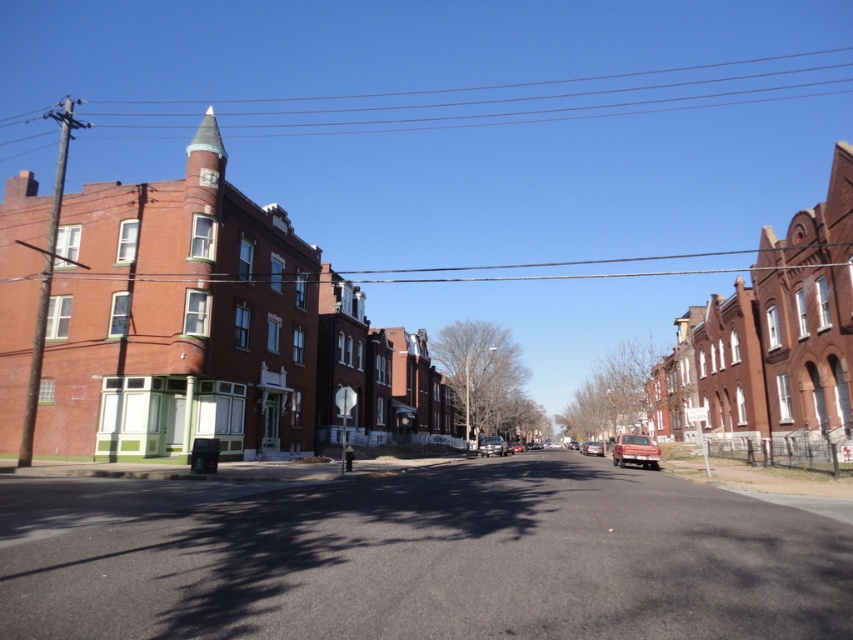
Question: Can you confirm if matte red car at center is positioned to the left of metallic silver car at center?

Choices:
 (A) yes
 (B) no

Answer: (A)

Question: Can you confirm if matte red car at center is positioned below shiny silver sedan at center?

Choices:
 (A) no
 (B) yes

Answer: (A)

Question: Which object is the farthest from the matte red car at center?

Choices:
 (A) metallic silver car at center
 (B) shiny silver sedan at center

Answer: (B)

Question: Estimate the real-world distances between objects in this image. Which object is farther from the matte red car at center?

Choices:
 (A) metallic silver car at center
 (B) shiny silver sedan at center

Answer: (B)

Question: Which object appears farthest from the camera in this image?

Choices:
 (A) matte red car at center
 (B) shiny silver sedan at center
 (C) metallic silver car at center

Answer: (B)

Question: Can you confirm if matte red car at center is positioned to the left of shiny silver sedan at center?

Choices:
 (A) no
 (B) yes

Answer: (A)